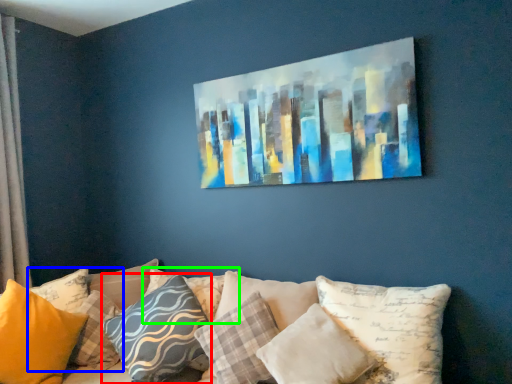
Question: Considering the real-world distances, which object is closest to pillow (highlighted by a red box)? pillow (highlighted by a blue box) or pillow (highlighted by a green box).

Choices:
 (A) pillow
 (B) pillow

Answer: (B)